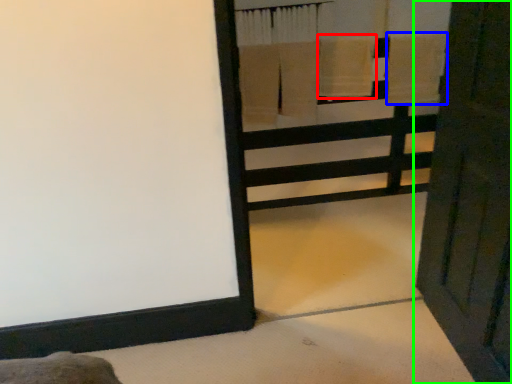
Question: Based on their relative distances, which object is nearer to bath towel (highlighted by a red box)? Choose from bath towel (highlighted by a blue box) and door (highlighted by a green box).

Choices:
 (A) bath towel
 (B) door

Answer: (A)